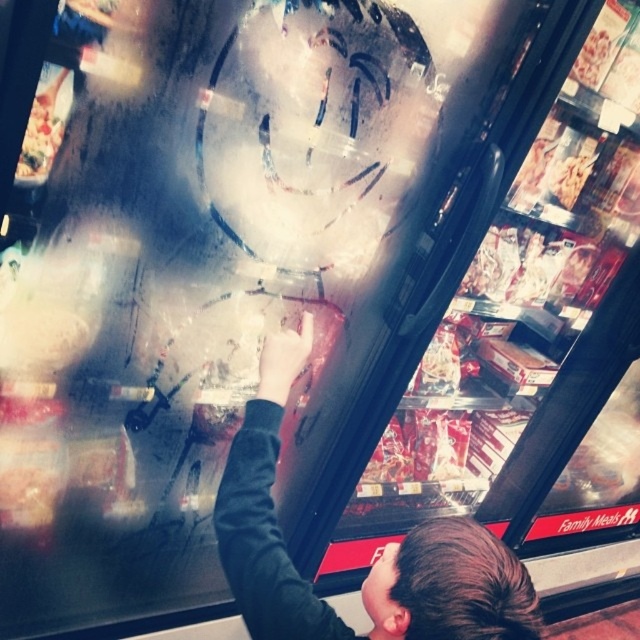
Question: Is black fabric at center in front of white cardboard box at upper left?

Choices:
 (A) no
 (B) yes

Answer: (B)

Question: Is black fabric at center above white cardboard box at upper left?

Choices:
 (A) yes
 (B) no

Answer: (B)

Question: Is black fabric at center thinner than white cardboard box at upper left?

Choices:
 (A) no
 (B) yes

Answer: (A)

Question: Among these objects, which one is nearest to the camera?

Choices:
 (A) black fabric at center
 (B) white cardboard box at upper left

Answer: (A)

Question: Which object is closer to the camera taking this photo?

Choices:
 (A) black fabric at center
 (B) white cardboard box at upper left

Answer: (A)